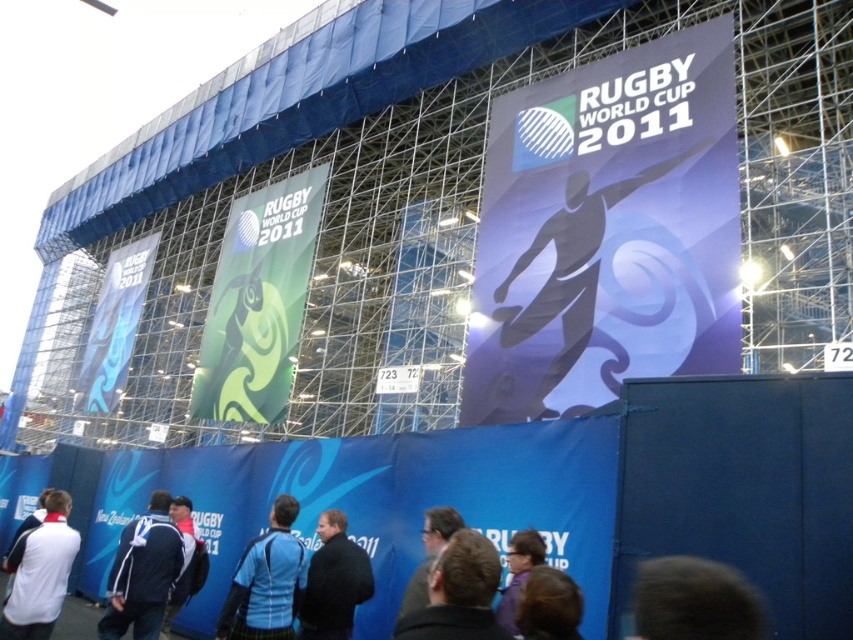
Between blue fabric jacket at lower left and purple fabric at center, which one is positioned lower?

Positioned lower is blue fabric jacket at lower left.

Is blue fabric jacket at lower left smaller than purple fabric at center?

Correct, blue fabric jacket at lower left occupies less space than purple fabric at center.

Locate an element on the screen. blue fabric jacket at lower left is located at coordinates (184, 561).

Can you confirm if dark brown leather jacket at center is positioned to the left of dark blue sweater at center?

In fact, dark brown leather jacket at center is to the right of dark blue sweater at center.

Between dark brown leather jacket at center and dark blue sweater at center, which one has less height?

With less height is dark brown leather jacket at center.

The width and height of the screenshot is (853, 640). Describe the element at coordinates (457, 593) in the screenshot. I see `dark brown leather jacket at center` at that location.

At what (x,y) coordinates should I click in order to perform the action: click on dark brown leather jacket at center. Please return your answer as a coordinate pair (x, y). The width and height of the screenshot is (853, 640). Looking at the image, I should click on (457, 593).

Which is below, dark brown hair at lower right or dark blue shirt at center?

Positioned lower is dark blue shirt at center.

Is point (738, 586) farther from camera compared to point (422, 586)?

No.

You are a GUI agent. You are given a task and a screenshot of the screen. Output one action in this format:
    pyautogui.click(x=<x>, y=<y>)
    Task: Click on the dark brown hair at lower right
    The height and width of the screenshot is (640, 853).
    Given the screenshot: What is the action you would take?
    pyautogui.click(x=694, y=600)